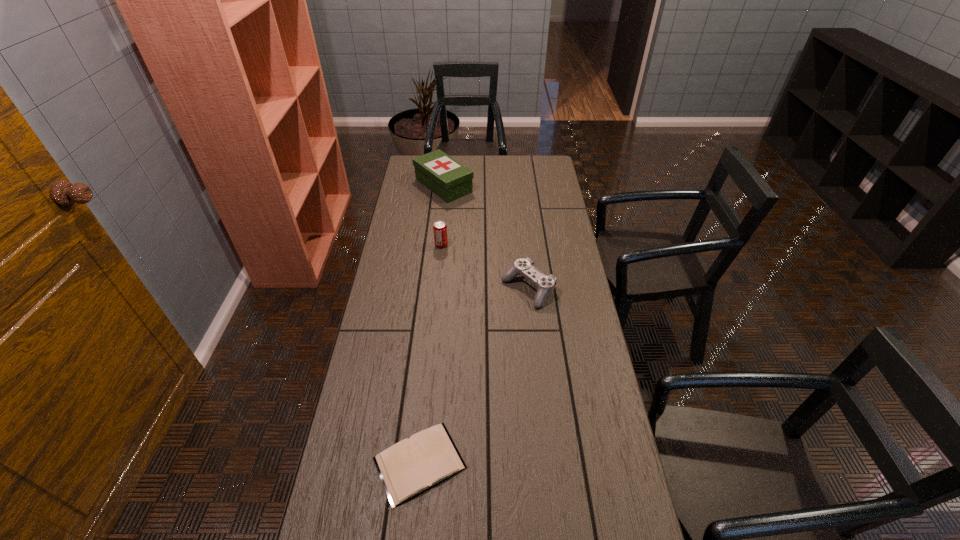
I want to click on vacant area that lies between the first-aid kit and the third tallest object, so click(x=486, y=238).

Where is `free space between the farthest object and the second farthest object`? The height and width of the screenshot is (540, 960). free space between the farthest object and the second farthest object is located at coordinates (443, 215).

Find the location of a particular element. The image size is (960, 540). vacant area between the hardback book and the first-aid kit is located at coordinates (432, 324).

Where is `vacant region between the first-aid kit and the hardback book`? Image resolution: width=960 pixels, height=540 pixels. vacant region between the first-aid kit and the hardback book is located at coordinates (432, 324).

Find the location of `empty space that is in between the second nearest object and the shortest object`. empty space that is in between the second nearest object and the shortest object is located at coordinates (474, 376).

This screenshot has width=960, height=540. I want to click on free area in between the first-aid kit and the rightmost object, so click(486, 238).

The width and height of the screenshot is (960, 540). I want to click on free space between the second farthest object and the rightmost object, so click(485, 267).

Identify the location of free space between the nearest object and the second shortest object. Image resolution: width=960 pixels, height=540 pixels. (474, 376).

Where is `object that ranks as the second closest to the farthest object`? object that ranks as the second closest to the farthest object is located at coordinates (545, 284).

I want to click on object that is the third closest to the control, so click(447, 178).